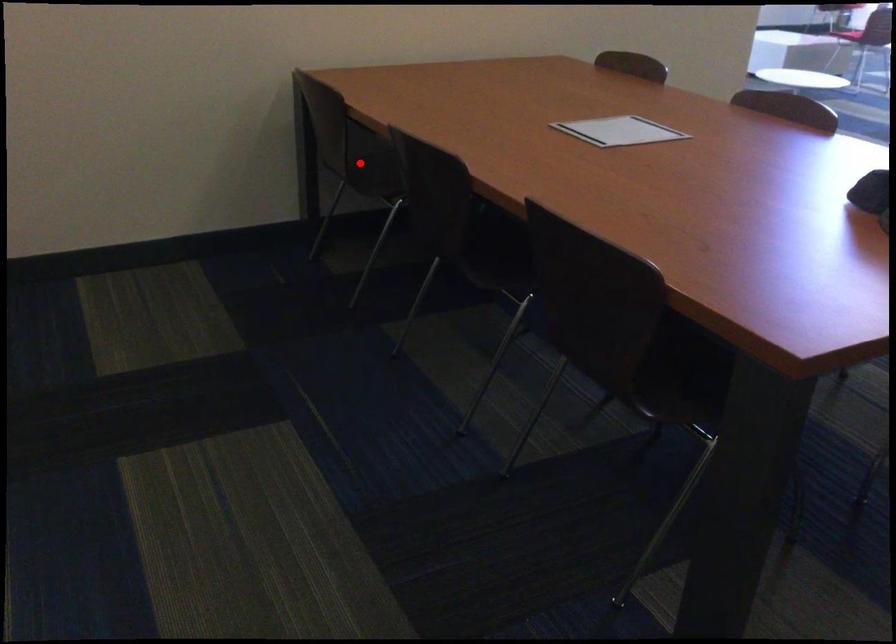
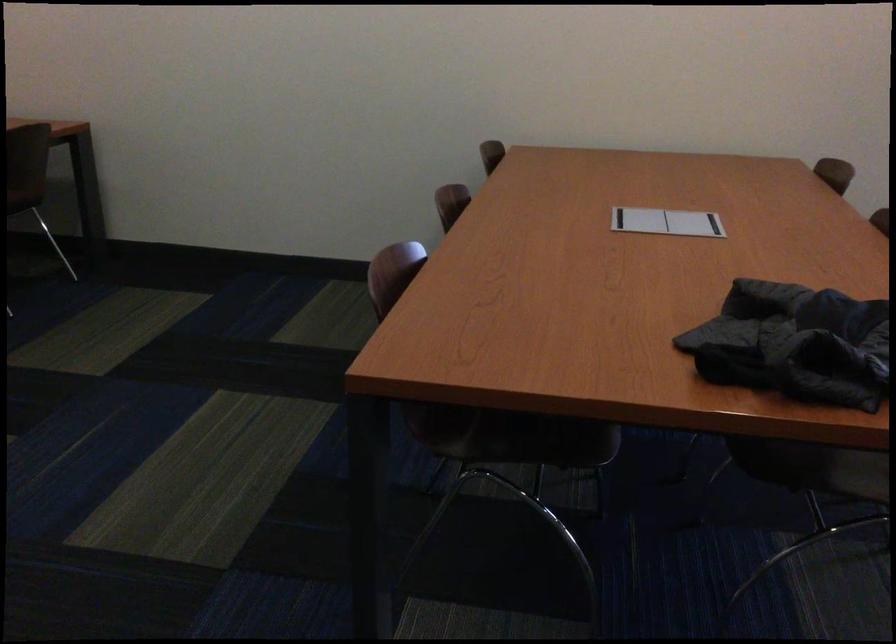
Question: I am providing you with two images of the same scene from different viewpoints. A red point is marked on the first image. Is the red point's position out of view in image 2?

Choices:
 (A) Yes
 (B) No

Answer: (A)